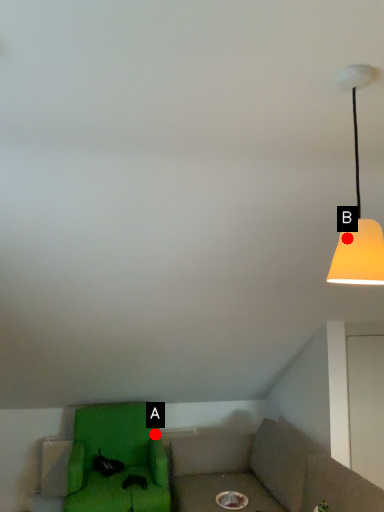
Question: Two points are circled on the image, labeled by A and B beside each circle. Which point appears closest to the camera in this image?

Choices:
 (A) A is closer
 (B) B is closer

Answer: (B)